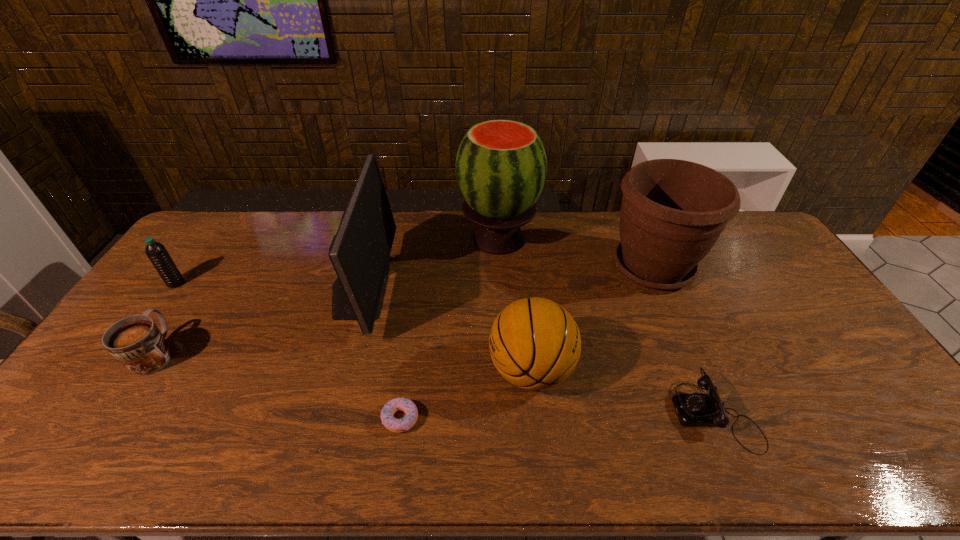
What are the coordinates of `vacant region located 0.180m on the side of the sixth tallest object with the handle` in the screenshot? It's located at (201, 288).

Where is `free location located on the front-facing side of the seventh tallest object`? The height and width of the screenshot is (540, 960). free location located on the front-facing side of the seventh tallest object is located at coordinates [555, 414].

Identify the location of free space located 0.330m on the front-facing side of the seventh tallest object. The width and height of the screenshot is (960, 540). coord(543,414).

You are a GUI agent. You are given a task and a screenshot of the screen. Output one action in this format:
    pyautogui.click(x=<x>, y=<y>)
    Task: Click on the free location located on the front-facing side of the seventh tallest object
    
    Given the screenshot: What is the action you would take?
    pyautogui.click(x=599, y=414)

I want to click on blank area located 0.210m on the left of the doughnut, so click(x=297, y=418).

Identify the location of watermelon situated at the far edge. The width and height of the screenshot is (960, 540). (501, 166).

In order to click on computer monitor that is at the far edge in this screenshot , I will do `click(360, 251)`.

I want to click on flowerpot present at the far edge, so click(x=673, y=211).

Find the location of `object positioned at the near edge`. object positioned at the near edge is located at coordinates (695, 409).

You are a GUI agent. You are given a task and a screenshot of the screen. Output one action in this format:
    pyautogui.click(x=<x>, y=<y>)
    Task: Click on the water bottle that is at the left edge
    The width and height of the screenshot is (960, 540).
    Given the screenshot: What is the action you would take?
    pyautogui.click(x=156, y=252)